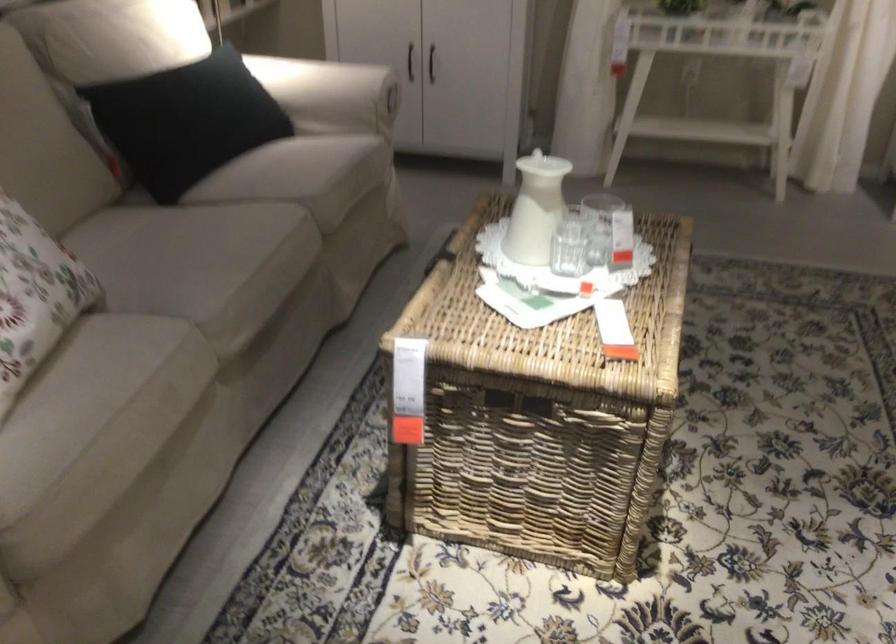
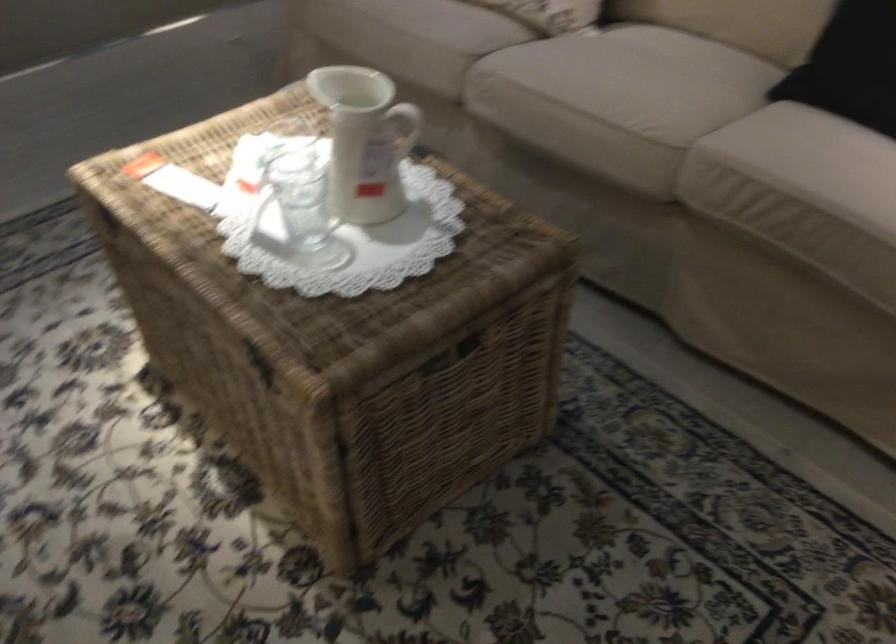
Find the pixel in the second image that matches point 539,190 in the first image.

(365, 140)